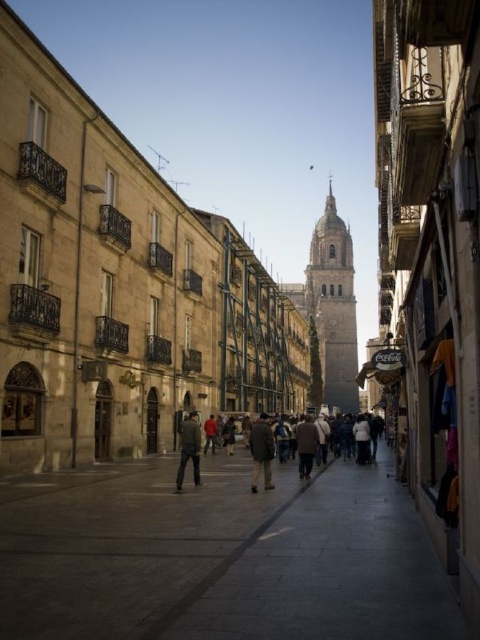
You are a tailor who needs to determine which garment requires a wider display hanger. You see the dark brown leather jacket at center and the brown wool coat at center in the image. Which one should you choose the wider hanger for?

The dark brown leather jacket at center has a larger width than the brown wool coat at center, so you should choose the wider hanger for the dark brown leather jacket at center.